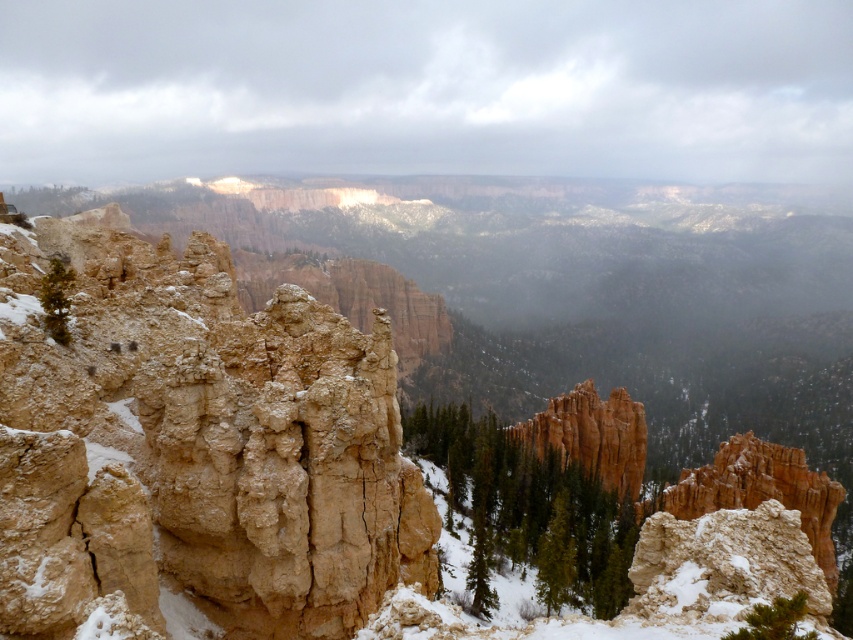
Question: Can you confirm if rugged sandstone canyon at center is wider than beige rough rock at left?

Choices:
 (A) yes
 (B) no

Answer: (A)

Question: Does rugged sandstone canyon at center appear under beige rough rock at left?

Choices:
 (A) no
 (B) yes

Answer: (A)

Question: Which of the following is the farthest from the observer?

Choices:
 (A) beige rough rock at left
 (B) rugged sandstone canyon at center

Answer: (B)

Question: Which of the following is the closest to the observer?

Choices:
 (A) rugged sandstone canyon at center
 (B) beige rough rock at left

Answer: (B)

Question: Which point is closer to the camera taking this photo?

Choices:
 (A) (109, 401)
 (B) (82, 403)

Answer: (B)

Question: Is rugged sandstone canyon at center in front of beige rough rock at left?

Choices:
 (A) yes
 (B) no

Answer: (B)